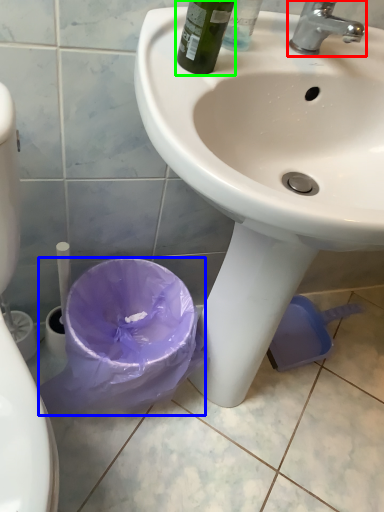
Question: Estimate the real-world distances between objects in this image. Which object is closer to tap (highlighted by a red box), garbage (highlighted by a blue box) or bottle (highlighted by a green box)?

Choices:
 (A) garbage
 (B) bottle

Answer: (B)